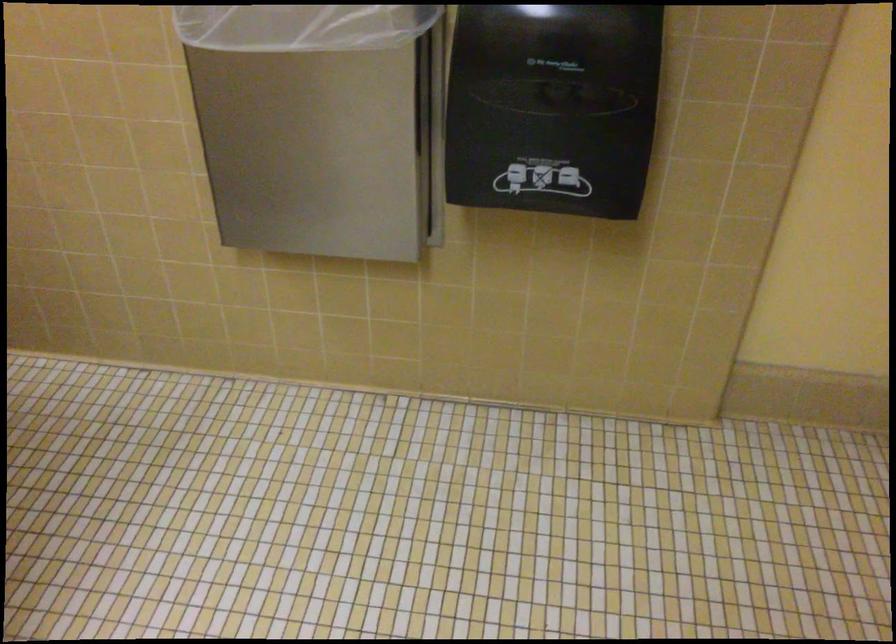
How did the camera likely rotate?

The camera rotated toward left-down.